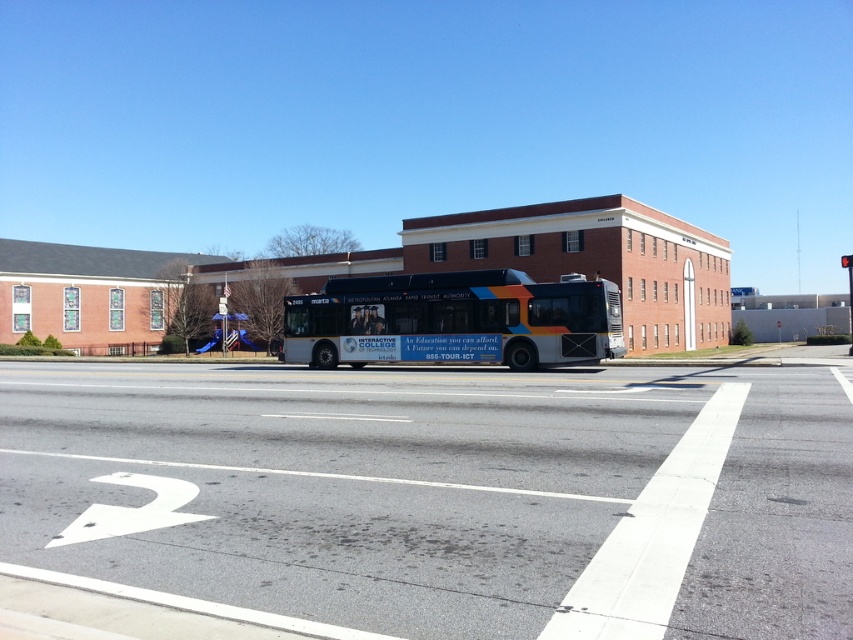
Does gray asphalt at center have a lesser height compared to white matte bus at center?

Yes.

Measure the distance between point (196, 593) and camera.

Point (196, 593) and camera are 4.35 meters apart.

Which is in front, point (663, 460) or point (399, 285)?

Point (663, 460)

The image size is (853, 640). I want to click on gray asphalt at center, so click(445, 493).

Based on the photo, can you confirm if gray asphalt at center is positioned to the left of blue plastic slide at lower center?

No, gray asphalt at center is not to the left of blue plastic slide at lower center.

Which is more to the left, gray asphalt at center or blue plastic slide at lower center?

blue plastic slide at lower center is more to the left.

Between point (743, 422) and point (213, 317), which one is positioned in front?

Point (743, 422)

Find the location of `gray asphalt at center`. gray asphalt at center is located at coordinates (445, 493).

Does white matte bus at center appear under blue plastic slide at lower center?

Actually, white matte bus at center is above blue plastic slide at lower center.

Between point (320, 369) and point (219, 330), which one is positioned behind?

The point (219, 330) is more distant.

Does point (605, 310) lie in front of point (254, 344)?

Yes, point (605, 310) is in front of point (254, 344).

The image size is (853, 640). I want to click on white matte bus at center, so click(x=454, y=321).